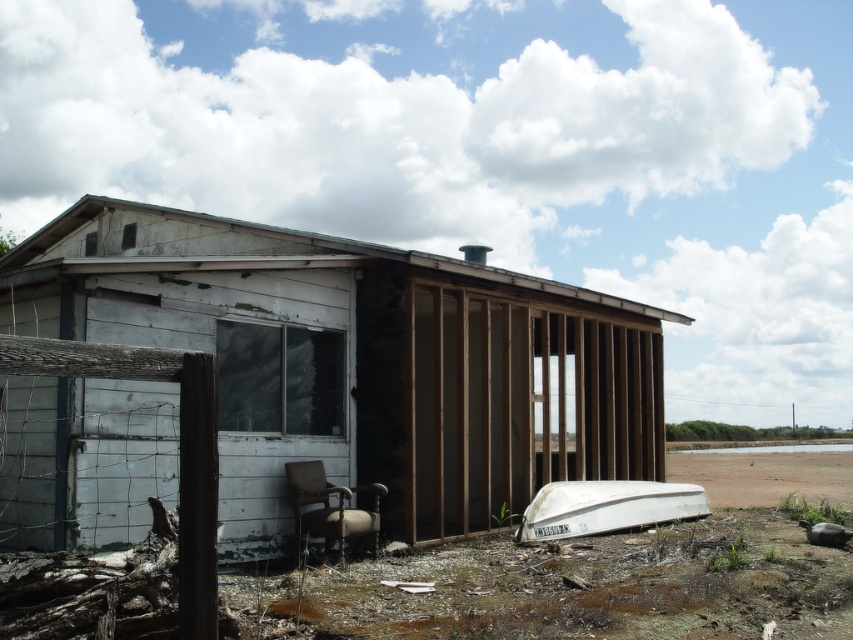
Question: Which of the following is the closest to the observer?

Choices:
 (A) white wood hut at center
 (B) brown fabric chair at lower left
 (C) white matte boat at lower right
 (D) brown sandy dirt at lower right

Answer: (A)

Question: Estimate the real-world distances between objects in this image. Which object is farther from the white matte boat at lower right?

Choices:
 (A) brown fabric chair at lower left
 (B) brown sandy dirt at lower right

Answer: (B)

Question: Does brown sandy dirt at lower right appear under white matte boat at lower right?

Choices:
 (A) no
 (B) yes

Answer: (B)

Question: Which object is the closest to the white wood hut at center?

Choices:
 (A) brown sandy dirt at lower right
 (B) brown fabric chair at lower left
 (C) white matte boat at lower right

Answer: (B)

Question: Does white wood hut at center have a greater width compared to brown fabric chair at lower left?

Choices:
 (A) yes
 (B) no

Answer: (A)

Question: Is white wood hut at center in front of brown sandy dirt at lower right?

Choices:
 (A) yes
 (B) no

Answer: (A)